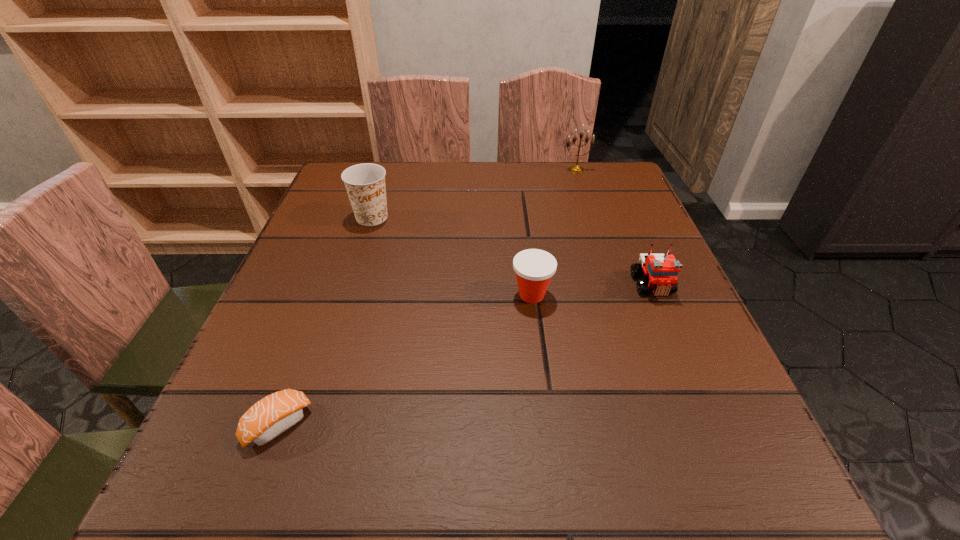
Find the location of a particular element. This screenshot has width=960, height=540. candelabrum is located at coordinates (575, 168).

Find the location of a particular element. This screenshot has height=540, width=960. the second object from right to left is located at coordinates (575, 168).

You are a GUI agent. You are given a task and a screenshot of the screen. Output one action in this format:
    pyautogui.click(x=<x>, y=<y>)
    Task: Click on the taller Dixie cup
    This screenshot has height=540, width=960.
    Given the screenshot: What is the action you would take?
    pyautogui.click(x=365, y=183)

The width and height of the screenshot is (960, 540). I want to click on the fourth nearest object, so click(365, 183).

At what (x,y) coordinates should I click in order to perform the action: click on the rightmost object. Please return your answer as a coordinate pair (x, y). The height and width of the screenshot is (540, 960). Looking at the image, I should click on (661, 271).

I want to click on the right Dixie cup, so click(x=534, y=268).

Identify the location of the third object from right to left. (534, 268).

Locate an element on the screen. sushi is located at coordinates (271, 416).

This screenshot has width=960, height=540. What are the coordinates of `the shortest object` in the screenshot? It's located at (271, 416).

Image resolution: width=960 pixels, height=540 pixels. In order to click on vacant space situated on the left of the farthest object in this screenshot , I will do `click(485, 170)`.